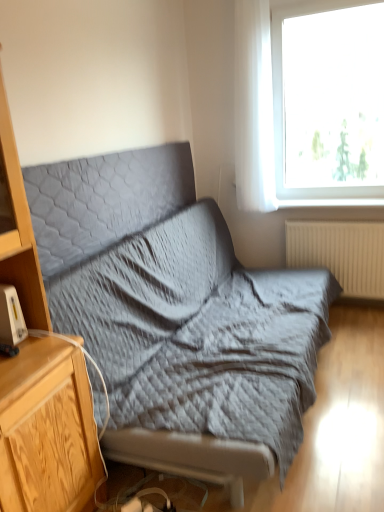
Question: Is textured gray fabric studio couch at center next to transparent glass window at upper right?

Choices:
 (A) yes
 (B) no

Answer: (B)

Question: Could you tell me if textured gray fabric studio couch at center is turned towards transparent glass window at upper right?

Choices:
 (A) no
 (B) yes

Answer: (A)

Question: Is transparent glass window at upper right inside textured gray fabric studio couch at center?

Choices:
 (A) no
 (B) yes

Answer: (A)

Question: From the image's perspective, is textured gray fabric studio couch at center located beneath transparent glass window at upper right?

Choices:
 (A) no
 (B) yes

Answer: (B)

Question: From a real-world perspective, is textured gray fabric studio couch at center beneath transparent glass window at upper right?

Choices:
 (A) yes
 (B) no

Answer: (A)

Question: Considering the relative positions of textured gray fabric studio couch at center and transparent glass window at upper right in the image provided, is textured gray fabric studio couch at center to the right of transparent glass window at upper right from the viewer's perspective?

Choices:
 (A) no
 (B) yes

Answer: (A)

Question: Is transparent glass window at upper right bigger than wooden cabinet at left?

Choices:
 (A) yes
 (B) no

Answer: (B)

Question: Is transparent glass window at upper right turned away from wooden cabinet at left?

Choices:
 (A) no
 (B) yes

Answer: (A)

Question: Is transparent glass window at upper right thinner than wooden cabinet at left?

Choices:
 (A) no
 (B) yes

Answer: (B)

Question: Is there a large distance between transparent glass window at upper right and wooden cabinet at left?

Choices:
 (A) no
 (B) yes

Answer: (B)

Question: Does transparent glass window at upper right have a greater height compared to wooden cabinet at left?

Choices:
 (A) no
 (B) yes

Answer: (A)

Question: Can you confirm if transparent glass window at upper right is wider than wooden cabinet at left?

Choices:
 (A) yes
 (B) no

Answer: (B)

Question: Is white plastic gadget at left behind beige ribbed radiator at lower right?

Choices:
 (A) yes
 (B) no

Answer: (B)